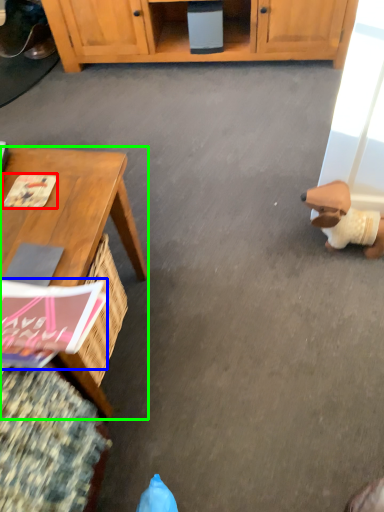
Question: Which object is positioned farthest from magazine (highlighted by a red box)? Select from magazine (highlighted by a blue box) and desk (highlighted by a green box).

Choices:
 (A) magazine
 (B) desk

Answer: (A)